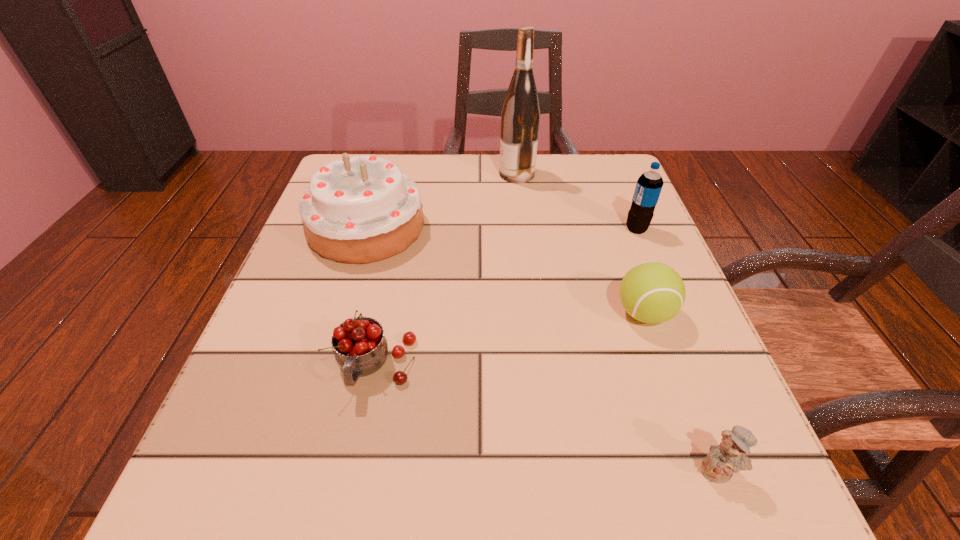
Locate an element on the screen. Image resolution: width=960 pixels, height=540 pixels. object present at the far left corner is located at coordinates (362, 209).

Find the location of a particular element. object present at the near right corner is located at coordinates (729, 456).

The width and height of the screenshot is (960, 540). In the image, there is a desktop. Find the location of `free space at the far edge`. free space at the far edge is located at coordinates (548, 154).

This screenshot has width=960, height=540. In the image, there is a desktop. What are the coordinates of `vacant space at the left edge` in the screenshot? It's located at (210, 444).

Find the location of a particular element. vacant space at the right edge of the desktop is located at coordinates (573, 213).

I want to click on free space at the near left corner of the desktop, so click(284, 503).

Locate an element on the screen. The height and width of the screenshot is (540, 960). vacant space at the far right corner of the desktop is located at coordinates (560, 154).

You are a GUI agent. You are given a task and a screenshot of the screen. Output one action in this format:
    pyautogui.click(x=<x>, y=<y>)
    Task: Click on the free space between the tennis ball and the teddy bear
    The height and width of the screenshot is (540, 960).
    Given the screenshot: What is the action you would take?
    pyautogui.click(x=681, y=392)

You are a GUI agent. You are given a task and a screenshot of the screen. Output one action in this format:
    pyautogui.click(x=<x>, y=<y>)
    Task: Click on the vacant area that lies between the cherry and the cake
    The width and height of the screenshot is (960, 540).
    Given the screenshot: What is the action you would take?
    pyautogui.click(x=372, y=296)

Identify the location of vacant point located between the tennis ball and the cake. (506, 271).